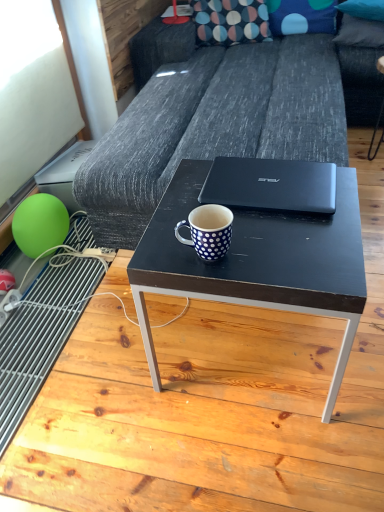
Locate an element on the screen. Image resolution: width=384 pixels, height=512 pixels. free space to the left of blue dotted mug at center is located at coordinates (159, 251).